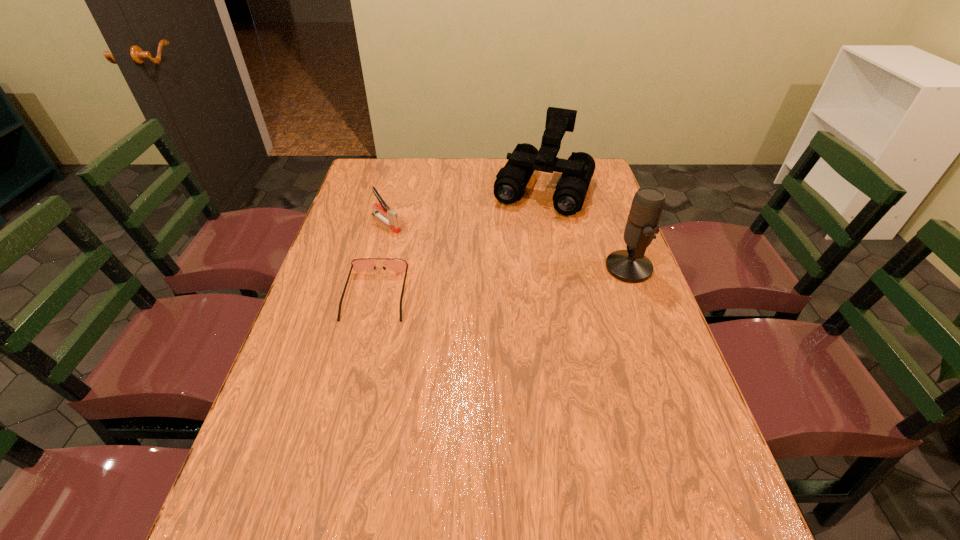
Image resolution: width=960 pixels, height=540 pixels. Find the location of `blank area located 0.110m on the front lenses of the binoculars`. blank area located 0.110m on the front lenses of the binoculars is located at coordinates (522, 238).

Find the location of a particular element. The width and height of the screenshot is (960, 540). object at the far edge is located at coordinates (511, 180).

Where is `sunglasses that is positioned at the left edge`? Image resolution: width=960 pixels, height=540 pixels. sunglasses that is positioned at the left edge is located at coordinates (362, 264).

Where is `stapler that is at the left edge`? stapler that is at the left edge is located at coordinates (393, 221).

Image resolution: width=960 pixels, height=540 pixels. In order to click on microphone that is positioned at the right edge in this screenshot , I will do [x=630, y=265].

This screenshot has width=960, height=540. I want to click on binoculars situated at the right edge, so click(511, 180).

What are the coordinates of `object at the far right corner` in the screenshot? It's located at (511, 180).

Where is `vacant space at the far edge of the desktop`? Image resolution: width=960 pixels, height=540 pixels. vacant space at the far edge of the desktop is located at coordinates (528, 189).

The image size is (960, 540). In the image, there is a desktop. What are the coordinates of `free space at the near edge` in the screenshot? It's located at (466, 489).

This screenshot has width=960, height=540. Find the location of `free point at the left edge`. free point at the left edge is located at coordinates (355, 359).